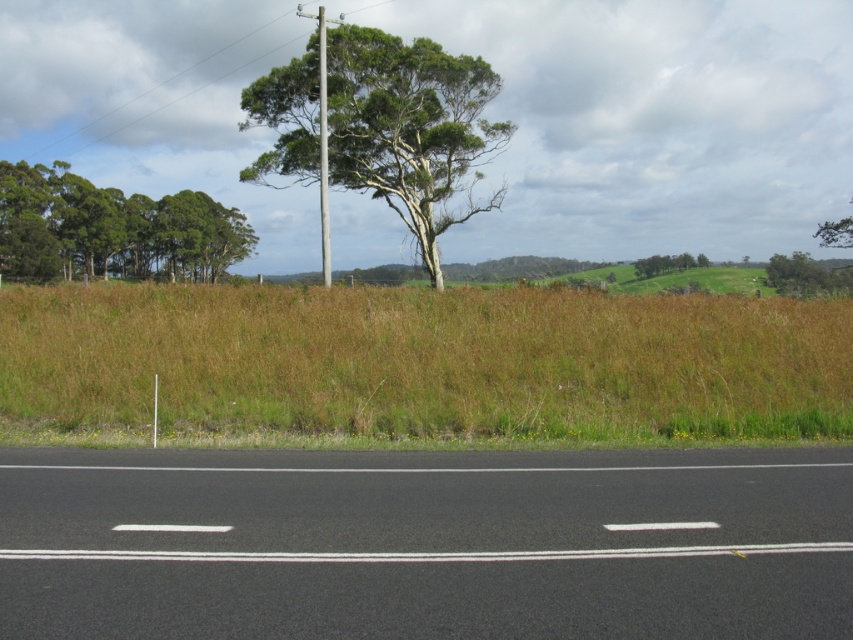
Question: Is green leafy trees at left wider than green leafy tree at upper center?

Choices:
 (A) yes
 (B) no

Answer: (B)

Question: Which point is farther from the camera taking this photo?

Choices:
 (A) (830, 285)
 (B) (134, 275)
 (C) (325, 179)

Answer: (B)

Question: Is green leafy trees at left to the left of green leafy tree at upper center from the viewer's perspective?

Choices:
 (A) no
 (B) yes

Answer: (B)

Question: Considering the real-world distances, which object is closest to the green leafy tree at center?

Choices:
 (A) green leafy tree at upper right
 (B) brown dry grass at center

Answer: (B)

Question: Which point is farther to the camera?

Choices:
 (A) (322, 234)
 (B) (25, 264)
 (C) (672, 266)

Answer: (A)

Question: Is black asphalt highway at center bigger than green leafy tree at upper center?

Choices:
 (A) yes
 (B) no

Answer: (B)